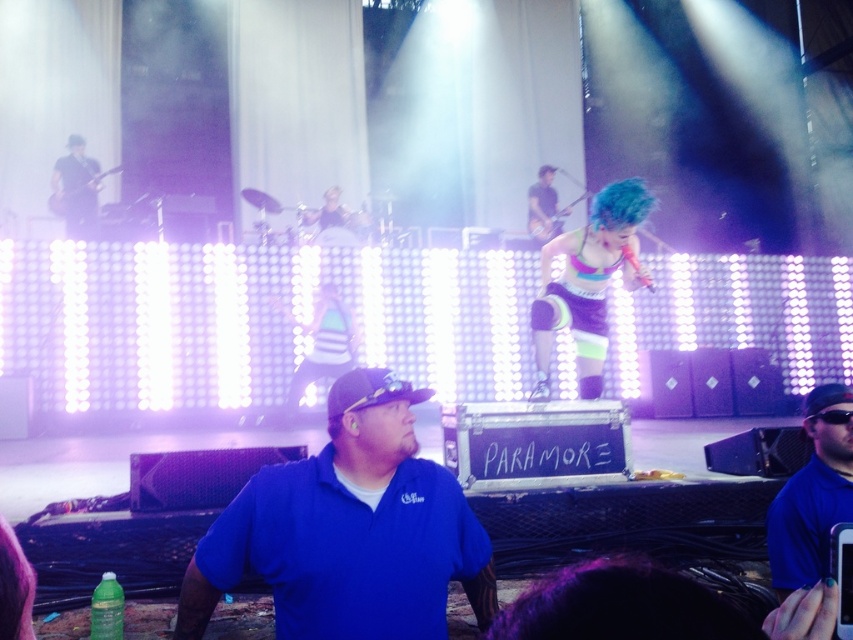
You are a photographer at the concert and want to capture a photo that includes both the blue shirt at lower right and the matte black guitar at upper left. Which object should you adjust your camera angle to focus on first if you want to ensure both are in frame?

The blue shirt at lower right is shorter than the matte black guitar at upper left, so you should focus on the blue shirt at lower right first to ensure both are in frame.

You are a photographer at the concert and need to capture a closeup shot of the blue shirt at lower right and the matte black guitar at upper left in the same frame. Given that your camera has a fixed focal length, which object should you position closer to the camera to ensure both fit in the frame?

Since the blue shirt at lower right is narrower than the matte black guitar at upper left, you should position the blue shirt at lower right closer to the camera to maintain its visibility while fitting both objects within the frame.

You are a photographer at the concert. You want to take a photo of the neon blue hair at center and the blue shirt at lower right in the same frame. The camera you have can capture objects within a 2 meters range. Can you fit both in the same shot?

The neon blue hair at center is 1.92 meters away from the blue shirt at lower right, so yes, both can be captured in the same frame since the distance between them is within the camera range of 2 meters.